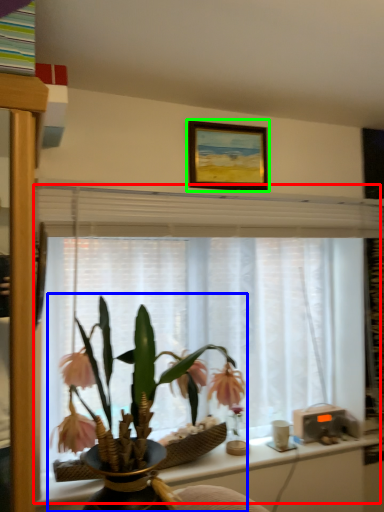
Question: Based on their relative distances, which object is nearer to window frame (highlighted by a red box)? Choose from houseplant (highlighted by a blue box) and picture frame (highlighted by a green box).

Choices:
 (A) houseplant
 (B) picture frame

Answer: (A)